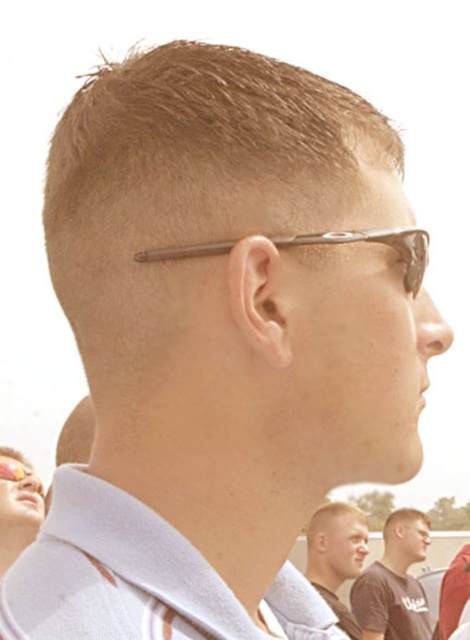
Is brown matte hair at center shorter than matte brown sunglasses at upper center?

In fact, brown matte hair at center may be taller than matte brown sunglasses at upper center.

Who is positioned more to the right, brown matte hair at center or matte brown sunglasses at upper center?

matte brown sunglasses at upper center is more to the right.

From the picture: Who is more forward, (360, 115) or (408, 276)?

Positioned in front is point (408, 276).

You are a GUI agent. You are given a task and a screenshot of the screen. Output one action in this format:
    pyautogui.click(x=<x>, y=<y>)
    Task: Click on the brown matte hair at center
    This screenshot has width=470, height=640.
    Given the screenshot: What is the action you would take?
    [x=236, y=275]

How distant is matte brown hair at upper left from sunglasses at upper center?

matte brown hair at upper left is 31.14 inches from sunglasses at upper center.

Between matte brown hair at upper left and sunglasses at upper center, which one has less height?

With less height is sunglasses at upper center.

Where is `matte brown hair at upper left`? This screenshot has width=470, height=640. matte brown hair at upper left is located at coordinates (76, 435).

Does dark brown t-shirt at center appear on the left side of light brown hair at center?

In fact, dark brown t-shirt at center is to the right of light brown hair at center.

Does dark brown t-shirt at center have a smaller size compared to light brown hair at center?

Actually, dark brown t-shirt at center might be larger than light brown hair at center.

Who is more forward, (399, 596) or (334, 589)?

Point (334, 589)

You are a GUI agent. You are given a task and a screenshot of the screen. Output one action in this format:
    pyautogui.click(x=<x>, y=<y>)
    Task: Click on the dark brown t-shirt at center
    This screenshot has width=470, height=640.
    Given the screenshot: What is the action you would take?
    pyautogui.click(x=394, y=582)